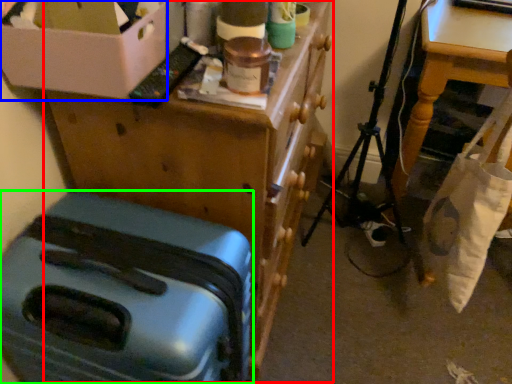
Question: Considering the real-world distances, which object is closest to furniture (highlighted by a red box)? box (highlighted by a blue box) or suitcase (highlighted by a green box).

Choices:
 (A) box
 (B) suitcase

Answer: (B)